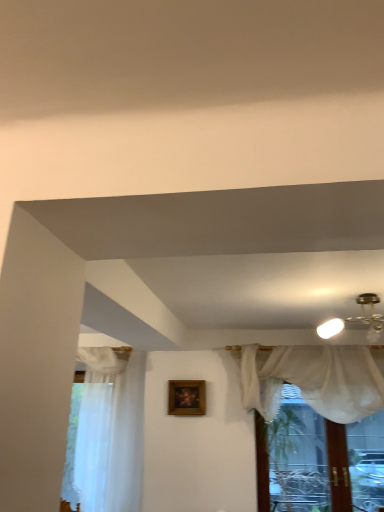
Locate an element on the screen. wooden frame at center is located at coordinates (187, 397).

From the image's perspective, is wooden frame at center above or below sheer white curtain at upper center?

Based on their image positions, wooden frame at center is located above sheer white curtain at upper center.

Is wooden frame at center positioned behind sheer white curtain at upper center?

Yes, wooden frame at center is further from the camera.

Does wooden frame at center turn towards sheer white curtain at upper center?

No, wooden frame at center is not oriented towards sheer white curtain at upper center.

Which of these two, wooden frame at center or sheer white curtain at upper center, is thinner?

With smaller width is wooden frame at center.

Would you say sheer white curtain at left is part of wooden frame at center's contents?

No, sheer white curtain at left is not a part of wooden frame at center.

Between wooden frame at center and sheer white curtain at left, which one is positioned behind?

wooden frame at center is behind.

Considering the relative sizes of wooden frame at center and sheer white curtain at left in the image provided, is wooden frame at center thinner than sheer white curtain at left?

Yes.

You are a GUI agent. You are given a task and a screenshot of the screen. Output one action in this format:
    pyautogui.click(x=<x>, y=<y>)
    Task: Click on the curtain below the wooden frame at center (from a real-world perspective)
    This screenshot has height=512, width=384.
    Given the screenshot: What is the action you would take?
    pyautogui.click(x=106, y=440)

From a real-world perspective, which object rests below the other?

sheer white curtain at left, from a real-world perspective.

This screenshot has height=512, width=384. Find the location of `curtain behind the sheer white curtain at upper center`. curtain behind the sheer white curtain at upper center is located at coordinates (106, 440).

Considering the relative sizes of sheer white curtain at upper center and sheer white curtain at left in the image provided, is sheer white curtain at upper center smaller than sheer white curtain at left?

Incorrect, sheer white curtain at upper center is not smaller in size than sheer white curtain at left.

Is sheer white curtain at upper center touching sheer white curtain at left?

They are not placed beside each other.

Is sheer white curtain at upper center to the right of wooden frame at center from the viewer's perspective?

Yes, sheer white curtain at upper center is to the right of wooden frame at center.

From a real-world perspective, which object rests below the other?

sheer white curtain at upper center, from a real-world perspective.

Locate an element on the screen. This screenshot has height=512, width=384. window located on the right of wooden frame at center is located at coordinates (318, 460).

Between sheer white curtain at upper center and wooden frame at center, which one is positioned in front?

sheer white curtain at upper center is more forward.

Can sheer white curtain at upper center be found inside sheer white curtain at left?

No, sheer white curtain at upper center is located outside of sheer white curtain at left.

Consider the image. How different are the orientations of sheer white curtain at left and sheer white curtain at upper center in degrees?

sheer white curtain at left and sheer white curtain at upper center are facing 0.233 degrees away from each other.

Consider the image. Is sheer white curtain at left facing away from sheer white curtain at upper center?

No, sheer white curtain at upper center is not at the back of sheer white curtain at left.

Considering the sizes of sheer white curtain at left and sheer white curtain at upper center in the image, is sheer white curtain at left bigger or smaller than sheer white curtain at upper center?

sheer white curtain at left is smaller than sheer white curtain at upper center.

Is sheer white curtain at left next to wooden frame at center?

No, sheer white curtain at left is not making contact with wooden frame at center.

Would you say sheer white curtain at left contains wooden frame at center?

No.

Considering the sizes of objects sheer white curtain at left and wooden frame at center in the image provided, who is wider, sheer white curtain at left or wooden frame at center?

sheer white curtain at left is wider.

Is sheer white curtain at left aimed at wooden frame at center?

No, sheer white curtain at left is not aimed at wooden frame at center.

Find the location of a particular element. window that appears on the right of wooden frame at center is located at coordinates (318, 460).

In the image, there is a wooden frame at center. Identify the location of curtain below it (from the image's perspective). The width and height of the screenshot is (384, 512). (106, 440).

Considering their positions, is sheer white curtain at upper center positioned further to sheer white curtain at left than wooden frame at center?

Based on the image, sheer white curtain at upper center appears to be further to sheer white curtain at left.

Based on their spatial positions, is wooden frame at center or sheer white curtain at upper center closer to sheer white curtain at left?

The object closer to sheer white curtain at left is wooden frame at center.

Based on their spatial positions, is sheer white curtain at left or sheer white curtain at upper center further from wooden frame at center?

Based on the image, sheer white curtain at upper center appears to be further to wooden frame at center.

From the picture: From the image, which object appears to be farther from sheer white curtain at upper center, sheer white curtain at left or wooden frame at center?

sheer white curtain at left is positioned further to the anchor sheer white curtain at upper center.

Estimate the real-world distances between objects in this image. Which object is further from sheer white curtain at upper center, wooden frame at center or sheer white curtain at left?

sheer white curtain at left lies further to sheer white curtain at upper center than the other object.

Based on their spatial positions, is sheer white curtain at upper center or sheer white curtain at left further from wooden frame at center?

Among the two, sheer white curtain at upper center is located further to wooden frame at center.

Find the location of a particular element. This screenshot has height=512, width=384. picture frame between sheer white curtain at left and sheer white curtain at upper center from left to right is located at coordinates (187, 397).